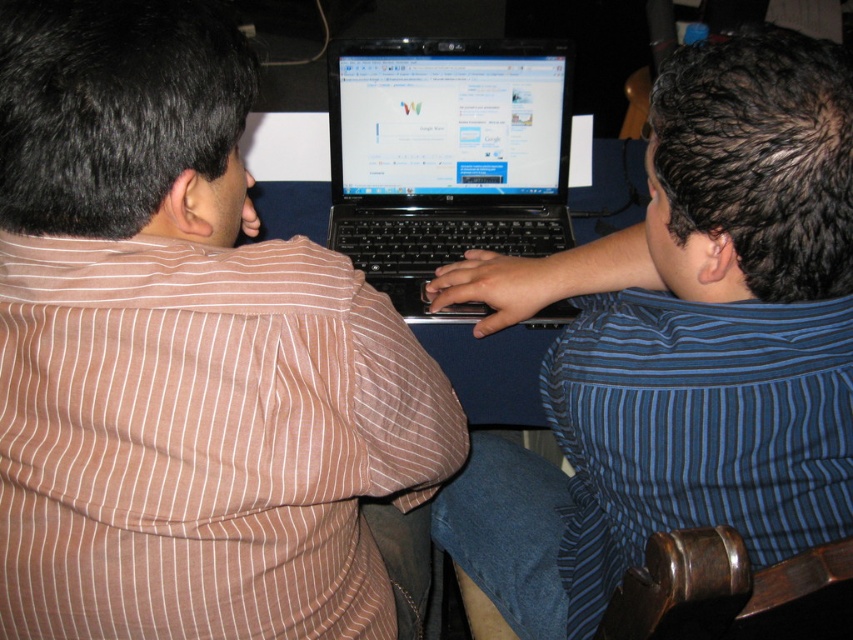
Question: Is blue striped shirt at center below black plastic laptop at center?

Choices:
 (A) yes
 (B) no

Answer: (A)

Question: Which point appears farthest from the camera in this image?

Choices:
 (A) (376, 205)
 (B) (155, 164)
 (C) (592, 577)

Answer: (A)

Question: Is brown striped shirt at left to the left of blue striped shirt at center from the viewer's perspective?

Choices:
 (A) yes
 (B) no

Answer: (A)

Question: Among these points, which one is farthest from the camera?

Choices:
 (A) (19, 80)
 (B) (437, 240)

Answer: (B)

Question: Among these objects, which one is nearest to the camera?

Choices:
 (A) blue striped shirt at center
 (B) brown striped shirt at left
 (C) black plastic laptop at center

Answer: (B)

Question: Does brown striped shirt at left appear under black plastic laptop at center?

Choices:
 (A) no
 (B) yes

Answer: (B)